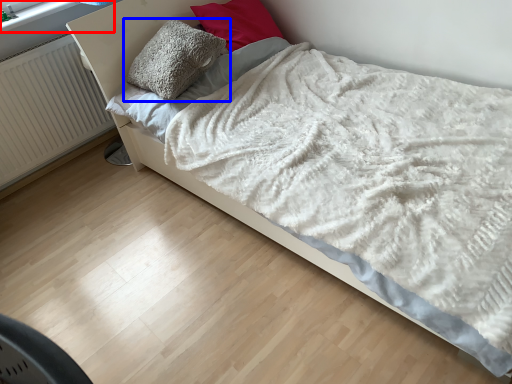
Question: Among these objects, which one is farthest to the camera, window frame (highlighted by a red box) or pillow (highlighted by a blue box)?

Choices:
 (A) window frame
 (B) pillow

Answer: (A)